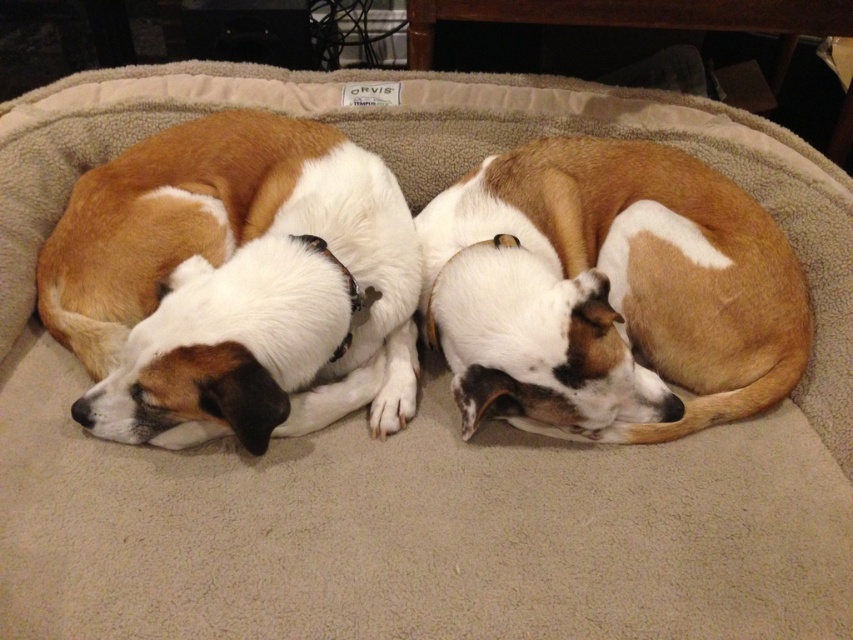
Can you confirm if brown and white fur at center is taller than brown/white fur dog at center?

Yes, brown and white fur at center is taller than brown/white fur dog at center.

Does point (149, 339) lie behind point (657, 412)?

That is False.

Measure the distance between point (279, 378) and camera.

Point (279, 378) and camera are 1.11 meters apart from each other.

Identify the location of brown and white fur at center. (235, 284).